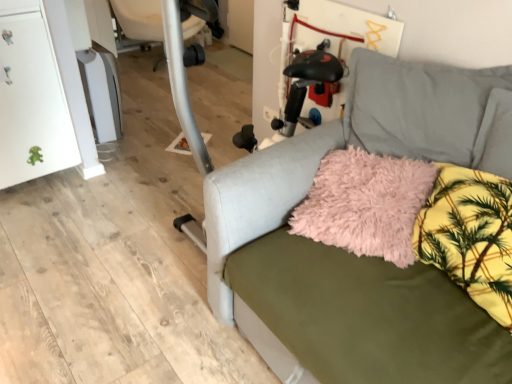
Question: Are yellow floral fabric pillow at lower right and white plastic swivel chair at upper left beside each other?

Choices:
 (A) no
 (B) yes

Answer: (A)

Question: Does yellow floral fabric pillow at lower right come in front of white plastic swivel chair at upper left?

Choices:
 (A) yes
 (B) no

Answer: (A)

Question: Is yellow floral fabric pillow at lower right at the left side of white plastic swivel chair at upper left?

Choices:
 (A) yes
 (B) no

Answer: (B)

Question: Is yellow floral fabric pillow at lower right to the right of white plastic swivel chair at upper left from the viewer's perspective?

Choices:
 (A) no
 (B) yes

Answer: (B)

Question: Can you confirm if yellow floral fabric pillow at lower right is wider than white plastic swivel chair at upper left?

Choices:
 (A) yes
 (B) no

Answer: (B)

Question: Is yellow floral fabric pillow at lower right located outside white plastic swivel chair at upper left?

Choices:
 (A) no
 (B) yes

Answer: (B)

Question: Does white plastic swivel chair at upper left have a greater width compared to yellow floral fabric pillow at lower right?

Choices:
 (A) yes
 (B) no

Answer: (A)

Question: Is white plastic swivel chair at upper left next to yellow floral fabric pillow at lower right?

Choices:
 (A) yes
 (B) no

Answer: (B)

Question: Does white plastic swivel chair at upper left have a greater height compared to yellow floral fabric pillow at lower right?

Choices:
 (A) yes
 (B) no

Answer: (A)

Question: From the image's perspective, is white plastic swivel chair at upper left on top of yellow floral fabric pillow at lower right?

Choices:
 (A) yes
 (B) no

Answer: (A)

Question: Can you confirm if white plastic swivel chair at upper left is thinner than yellow floral fabric pillow at lower right?

Choices:
 (A) yes
 (B) no

Answer: (B)

Question: Does white plastic swivel chair at upper left turn towards yellow floral fabric pillow at lower right?

Choices:
 (A) no
 (B) yes

Answer: (B)

Question: Is matte gray couch at center oriented towards fluffy pink pillow at center?

Choices:
 (A) no
 (B) yes

Answer: (B)